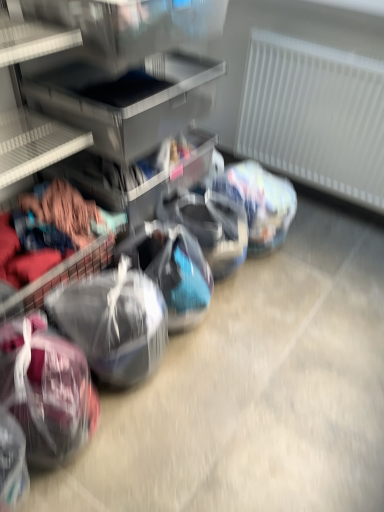
Question: Is translucent plastic sack at lower left, the 1th sack positioned from the right, further to camera compared to white textured radiator at right?

Choices:
 (A) no
 (B) yes

Answer: (A)

Question: Can you confirm if translucent plastic sack at lower left, the 1th sack positioned from the right, is thinner than white textured radiator at right?

Choices:
 (A) yes
 (B) no

Answer: (B)

Question: Is translucent plastic sack at lower left, which is counted as the 2th sack, starting from the left, outside white textured radiator at right?

Choices:
 (A) no
 (B) yes

Answer: (B)

Question: Is translucent plastic sack at lower left, which is counted as the 2th sack, starting from the left, facing towards white textured radiator at right?

Choices:
 (A) yes
 (B) no

Answer: (B)

Question: Is translucent plastic sack at lower left, which is counted as the 2th sack, starting from the left, bigger than white textured radiator at right?

Choices:
 (A) no
 (B) yes

Answer: (A)

Question: From a real-world perspective, is translucent plastic sack at lower left, the 1th sack positioned from the right, physically above white textured radiator at right?

Choices:
 (A) no
 (B) yes

Answer: (A)

Question: Does maroon fabric sack at lower left, the second sack when ordered from right to left, touch white textured radiator at right?

Choices:
 (A) yes
 (B) no

Answer: (B)

Question: Is maroon fabric sack at lower left, which appears as the first sack when viewed from the left, looking in the opposite direction of white textured radiator at right?

Choices:
 (A) yes
 (B) no

Answer: (B)

Question: From the image's perspective, is maroon fabric sack at lower left, which appears as the first sack when viewed from the left, over white textured radiator at right?

Choices:
 (A) no
 (B) yes

Answer: (A)

Question: Considering the relative sizes of maroon fabric sack at lower left, which appears as the first sack when viewed from the left, and white textured radiator at right in the image provided, is maroon fabric sack at lower left, which appears as the first sack when viewed from the left, bigger than white textured radiator at right?

Choices:
 (A) yes
 (B) no

Answer: (B)

Question: Considering the relative positions of maroon fabric sack at lower left, which appears as the first sack when viewed from the left, and white textured radiator at right in the image provided, is maroon fabric sack at lower left, which appears as the first sack when viewed from the left, to the right of white textured radiator at right from the viewer's perspective?

Choices:
 (A) yes
 (B) no

Answer: (B)

Question: Is maroon fabric sack at lower left, the second sack when ordered from right to left, surrounding white textured radiator at right?

Choices:
 (A) no
 (B) yes

Answer: (A)

Question: Is translucent plastic sack at lower left, which is counted as the 2th sack, starting from the left, located within white textured radiator at right?

Choices:
 (A) yes
 (B) no

Answer: (B)